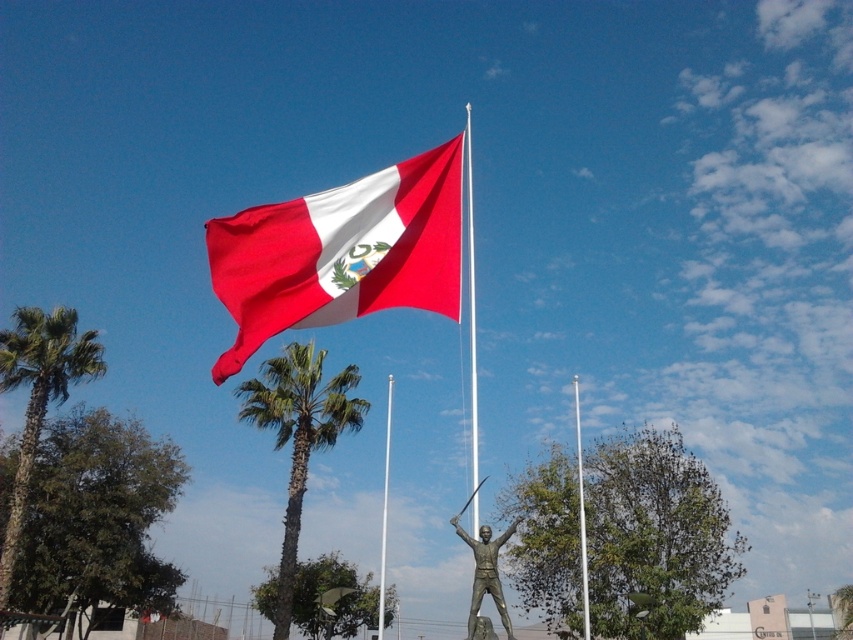
Which of these two, green leafy palm tree at left or polished bronze statue at center, stands shorter?

Standing shorter between the two is polished bronze statue at center.

Who is more distant from viewer, [50,344] or [503,627]?

Point [50,344]

You are a GUI agent. You are given a task and a screenshot of the screen. Output one action in this format:
    pyautogui.click(x=<x>, y=<y>)
    Task: Click on the green leafy palm tree at left
    
    Given the screenshot: What is the action you would take?
    39,396

Which is behind, point (332, 406) or point (583, 624)?

The point (583, 624) is behind.

Looking at this image, is green leafy palm tree at center thinner than metallic pole at center?

Correct, green leafy palm tree at center's width is less than metallic pole at center's.

Which is in front, point (352, 371) or point (583, 529)?

Point (583, 529) is in front.

Locate an element on the screen. This screenshot has height=640, width=853. green leafy palm tree at center is located at coordinates (299, 436).

Does matte fabric flag at upper center have a greater width compared to polished metal flag pole at center?

Yes, matte fabric flag at upper center is wider than polished metal flag pole at center.

Who is taller, matte fabric flag at upper center or polished metal flag pole at center?

polished metal flag pole at center

Is point (355, 291) farther from camera compared to point (469, 284)?

That is False.

Where is `matte fabric flag at upper center`? matte fabric flag at upper center is located at coordinates (341, 252).